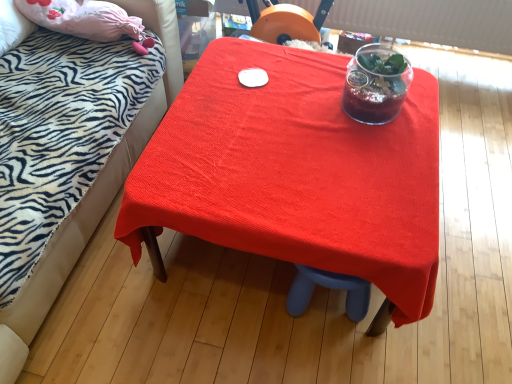
Where is `vacant point to the right of translucent glass vase at upper center`? This screenshot has height=384, width=512. vacant point to the right of translucent glass vase at upper center is located at coordinates (416, 109).